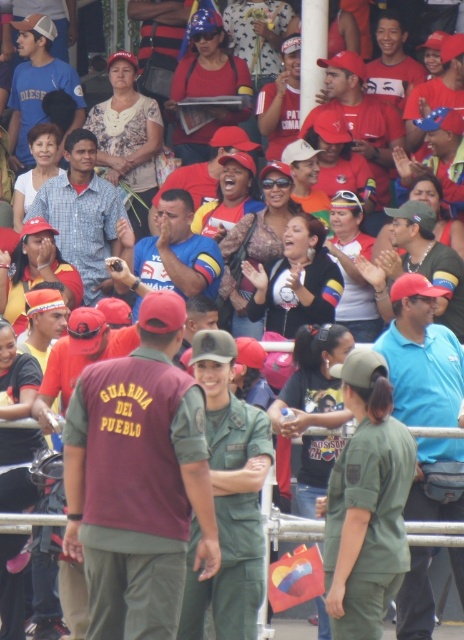
You are at a public event and want to identify which object is larger between the matte blue shirt at center and the matte red cap at center. Based on the scene, which one is larger?

The matte blue shirt at center is bigger than the matte red cap at center.

You are standing at the edge of the crowd and want to hand a leaflet to the person wearing the maroon uniform at center and the blue cotton shirt at center. If you can only reach up to 25 feet, which person can you reach?

The blue cotton shirt at center is within reach since it is closer than the maroon uniform at center, which is 26.08 feet away beyond your 25 feet reach limit.

You are a photographer at the event and want to capture a photo that includes both the blue cotton shirt at center and the matte blue shirt at center. Which one should you focus on first to ensure both are in the frame?

You should focus on the matte blue shirt at center first because it is above the blue cotton shirt at center, so adjusting the camera angle to include the upper one first will naturally capture the lower one as well.